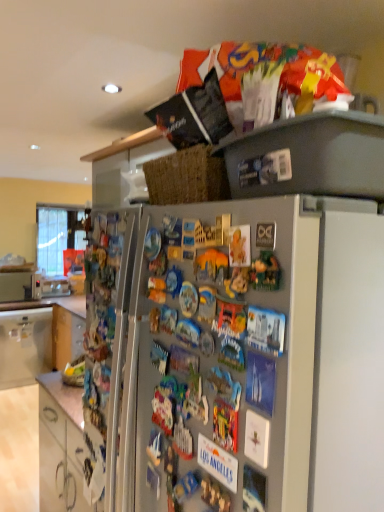
Question: Does white glossy cabinet at lower left, acting as the second cabinetry starting from the top, turn towards satin silver fridge at upper center?

Choices:
 (A) yes
 (B) no

Answer: (B)

Question: Considering the relative positions of white glossy cabinet at lower left, acting as the second cabinetry starting from the top, and satin silver fridge at upper center in the image provided, is white glossy cabinet at lower left, acting as the second cabinetry starting from the top, to the right of satin silver fridge at upper center from the viewer's perspective?

Choices:
 (A) no
 (B) yes

Answer: (A)

Question: From a real-world perspective, is white glossy cabinet at lower left, which appears as the first cabinetry when viewed from the front, physically below satin silver fridge at upper center?

Choices:
 (A) yes
 (B) no

Answer: (A)

Question: From the image's perspective, would you say white glossy cabinet at lower left, positioned as the 2th cabinetry in back-to-front order, is positioned over satin silver fridge at upper center?

Choices:
 (A) no
 (B) yes

Answer: (A)

Question: Is white glossy cabinet at lower left, which appears as the first cabinetry when viewed from the front, turned away from satin silver fridge at upper center?

Choices:
 (A) yes
 (B) no

Answer: (B)

Question: Does white glossy cabinet at lower left, which is the 1th cabinetry in bottom-to-top order, have a larger size compared to satin silver fridge at upper center?

Choices:
 (A) no
 (B) yes

Answer: (A)

Question: Considering the relative sizes of white glossy cabinet at lower left, positioned as the second cabinetry in front-to-back order, and metallic silver microwave at left in the image provided, is white glossy cabinet at lower left, positioned as the second cabinetry in front-to-back order, shorter than metallic silver microwave at left?

Choices:
 (A) no
 (B) yes

Answer: (A)

Question: Is metallic silver microwave at left completely or partially inside white glossy cabinet at lower left, positioned as the second cabinetry in front-to-back order?

Choices:
 (A) no
 (B) yes

Answer: (A)

Question: From a real-world perspective, is white glossy cabinet at lower left, positioned as the second cabinetry in front-to-back order, positioned under metallic silver microwave at left based on gravity?

Choices:
 (A) no
 (B) yes

Answer: (B)

Question: From the image's perspective, is white glossy cabinet at lower left, which is counted as the first cabinetry, starting from the back, on metallic silver microwave at left?

Choices:
 (A) no
 (B) yes

Answer: (A)

Question: Would you say white glossy cabinet at lower left, positioned as the second cabinetry in front-to-back order, is outside metallic silver microwave at left?

Choices:
 (A) no
 (B) yes

Answer: (B)

Question: From the image's perspective, is white glossy cabinet at lower left, positioned as the second cabinetry in front-to-back order, under metallic silver microwave at left?

Choices:
 (A) yes
 (B) no

Answer: (A)

Question: Is metallic silver microwave at left with white glossy cabinet at lower left, positioned as the second cabinetry in front-to-back order?

Choices:
 (A) yes
 (B) no

Answer: (B)